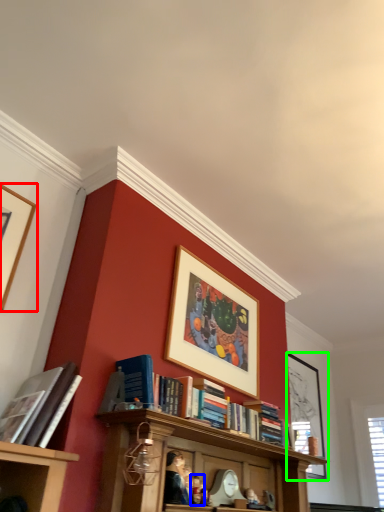
Question: Which object is the farthest from picture frame (highlighted by a red box)? Choose among these: person (highlighted by a blue box) or picture frame (highlighted by a green box).

Choices:
 (A) person
 (B) picture frame

Answer: (B)